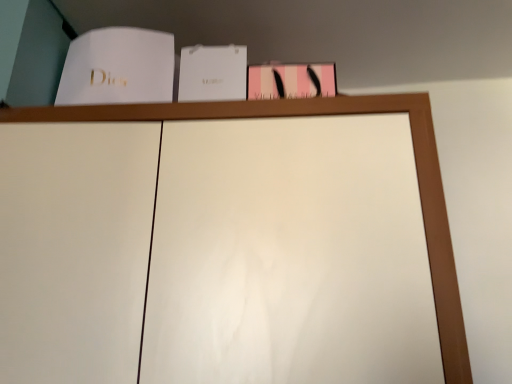
Question: From the image's perspective, is white paper at center, the 1th paperback book from the right, above or below white paper at upper left, which is the 2th paperback book in right-to-left order?

Choices:
 (A) above
 (B) below

Answer: (B)

Question: Is point (238, 56) closer or farther from the camera than point (72, 56)?

Choices:
 (A) farther
 (B) closer

Answer: (A)

Question: Looking at their shapes, would you say white paper at center, the second paperback book in the left-to-right sequence, is wider or thinner than white paper at upper left, placed as the first paperback book when sorted from left to right?

Choices:
 (A) thin
 (B) wide

Answer: (A)

Question: Is white paper at upper left, placed as the first paperback book when sorted from left to right, bigger or smaller than white paper at center, the second paperback book in the left-to-right sequence?

Choices:
 (A) big
 (B) small

Answer: (A)

Question: Is white paper at upper left, placed as the first paperback book when sorted from left to right, taller or shorter than white paper at center, the 1th paperback book from the right?

Choices:
 (A) short
 (B) tall

Answer: (B)

Question: Relative to white paper at center, the second paperback book in the left-to-right sequence, is white paper at upper left, placed as the first paperback book when sorted from left to right, in front or behind?

Choices:
 (A) behind
 (B) front

Answer: (B)

Question: Considering the positions of white paper at upper left, which is the 2th paperback book in right-to-left order, and white paper at center, the 1th paperback book from the right, in the image, is white paper at upper left, which is the 2th paperback book in right-to-left order, wider or thinner than white paper at center, the 1th paperback book from the right,?

Choices:
 (A) thin
 (B) wide

Answer: (B)